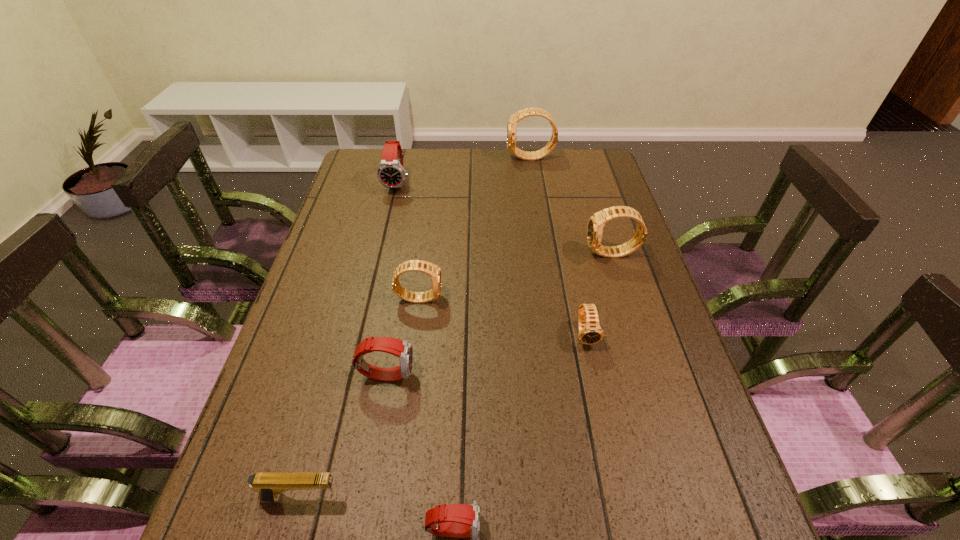
Image resolution: width=960 pixels, height=540 pixels. I want to click on red watch that is the second closest to the pistol, so click(x=402, y=349).